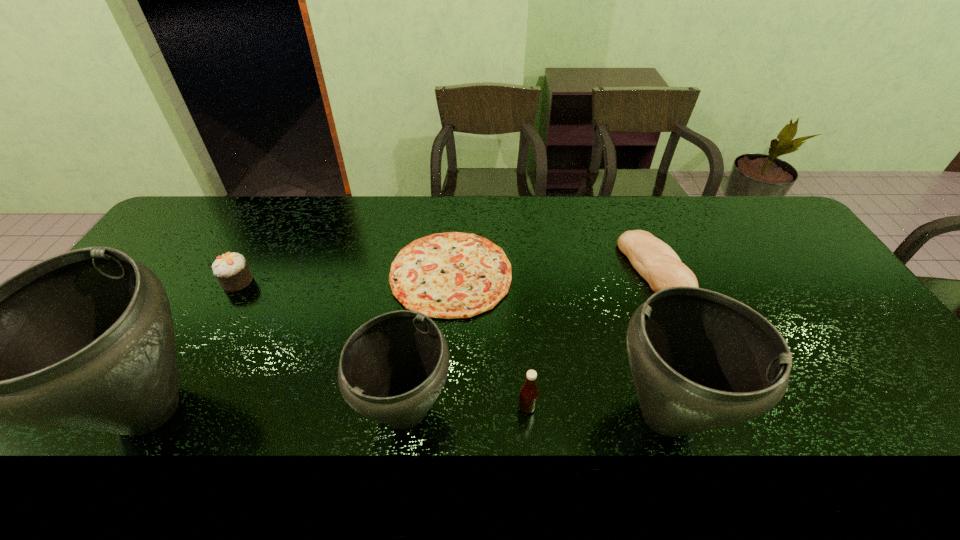
Find the location of a particular element. This screenshot has width=960, height=540. vacant space located 0.240m on the back of the tallest object is located at coordinates (221, 284).

Identify the location of vacant space located on the right of the third tallest object. (543, 412).

Where is `vacant area located 0.180m on the right of the second tallest urn`? vacant area located 0.180m on the right of the second tallest urn is located at coordinates (805, 415).

You are a GUI agent. You are given a task and a screenshot of the screen. Output one action in this format:
    pyautogui.click(x=<x>, y=<y>)
    Task: Click on the vacant space situated 0.340m on the front of the cupcake
    This screenshot has height=540, width=960.
    Given the screenshot: What is the action you would take?
    pyautogui.click(x=176, y=394)

This screenshot has height=540, width=960. I want to click on vacant space located on the right of the second shortest object, so click(797, 270).

Where is `free region located 0.390m on the right of the shortest object`? Image resolution: width=960 pixels, height=540 pixels. free region located 0.390m on the right of the shortest object is located at coordinates pyautogui.click(x=637, y=274).

Identify the location of vacant space located 0.100m on the back of the Tabasco sauce. click(x=523, y=364).

Identify the location of bread located at the far edge. (655, 261).

The height and width of the screenshot is (540, 960). Identify the location of pizza present at the far edge. (452, 275).

What are the coordinates of `Tabasco sauce that is at the near edge` in the screenshot? It's located at tap(528, 397).